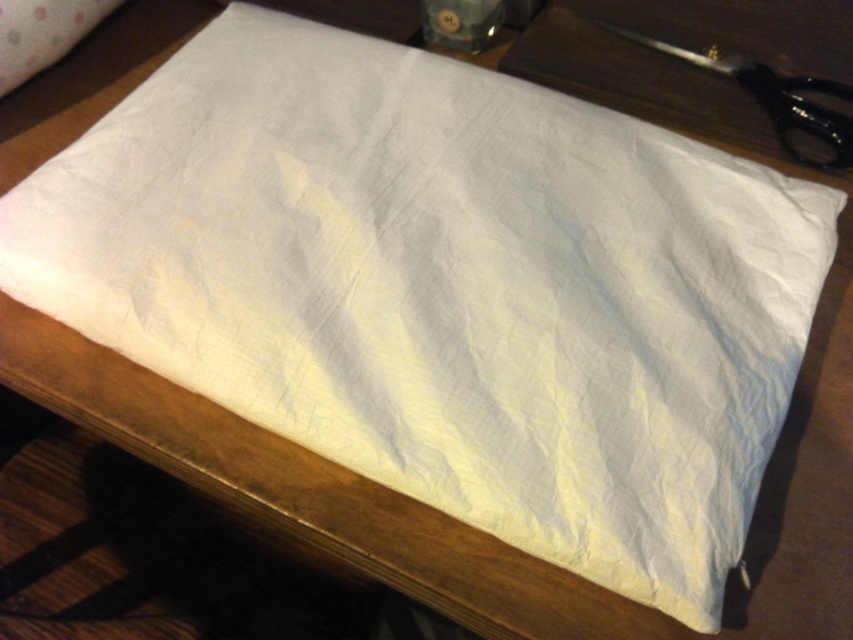
Is black plastic scissors at upper right thinner than white fabric pillow at upper left?

No.

Is black plastic scissors at upper right to the right of white fabric pillow at upper left from the viewer's perspective?

Correct, you'll find black plastic scissors at upper right to the right of white fabric pillow at upper left.

Is point (782, 88) farther from viewer compared to point (56, 52)?

No, it is in front of (56, 52).

Where is `black plastic scissors at upper right`? Image resolution: width=853 pixels, height=640 pixels. black plastic scissors at upper right is located at coordinates (770, 97).